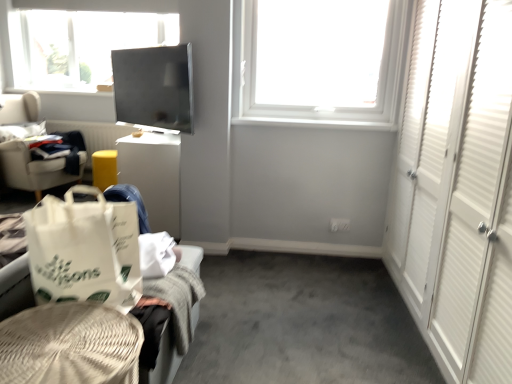
Question: Is light gray fabric chair at left aimed at woven beige basket at lower left, marked as the 1th furniture in a front-to-back arrangement?

Choices:
 (A) yes
 (B) no

Answer: (B)

Question: From the image's perspective, is light gray fabric chair at left located beneath woven beige basket at lower left, acting as the 2th furniture starting from the back?

Choices:
 (A) yes
 (B) no

Answer: (B)

Question: From the image's perspective, is light gray fabric chair at left above woven beige basket at lower left, acting as the 2th furniture starting from the back?

Choices:
 (A) no
 (B) yes

Answer: (B)

Question: Can you confirm if light gray fabric chair at left is wider than woven beige basket at lower left, marked as the 1th furniture in a front-to-back arrangement?

Choices:
 (A) yes
 (B) no

Answer: (A)

Question: Is light gray fabric chair at left further to camera compared to woven beige basket at lower left, marked as the 1th furniture in a front-to-back arrangement?

Choices:
 (A) yes
 (B) no

Answer: (A)

Question: Can you confirm if light gray fabric chair at left is smaller than woven beige basket at lower left, marked as the 1th furniture in a front-to-back arrangement?

Choices:
 (A) yes
 (B) no

Answer: (B)

Question: From the image's perspective, would you say white cardboard box at center-left is shown under light gray fabric chair at left?

Choices:
 (A) yes
 (B) no

Answer: (A)

Question: Can you confirm if white cardboard box at center-left is shorter than light gray fabric chair at left?

Choices:
 (A) no
 (B) yes

Answer: (B)

Question: Is white cardboard box at center-left aimed at light gray fabric chair at left?

Choices:
 (A) yes
 (B) no

Answer: (A)

Question: From the image's perspective, is white cardboard box at center-left over light gray fabric chair at left?

Choices:
 (A) yes
 (B) no

Answer: (B)

Question: Is white cardboard box at center-left smaller than light gray fabric chair at left?

Choices:
 (A) yes
 (B) no

Answer: (A)

Question: Does white cardboard box at center-left contain light gray fabric chair at left?

Choices:
 (A) yes
 (B) no

Answer: (B)

Question: Is woven beige basket at lower left, marked as the 1th furniture in a front-to-back arrangement, wider than white cardboard box at center-left?

Choices:
 (A) yes
 (B) no

Answer: (B)